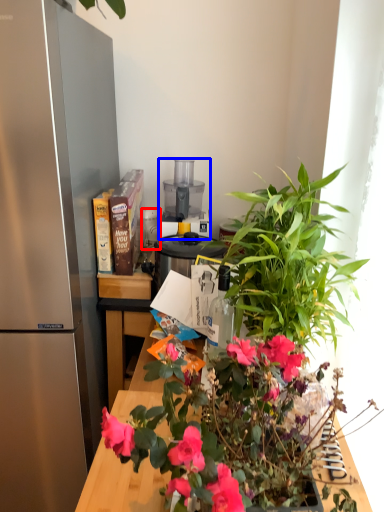
Question: Among these objects, which one is nearest to the camera, appliance (highlighted by a red box) or appliance (highlighted by a blue box)?

Choices:
 (A) appliance
 (B) appliance

Answer: (B)